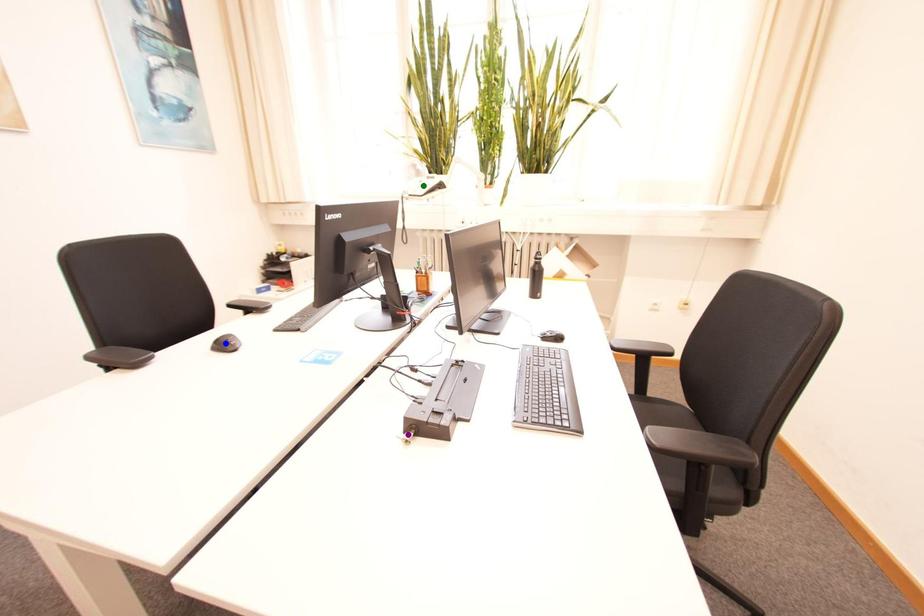
Order these from farthest to nearest:
1. green point
2. purple point
3. blue point

green point → blue point → purple point